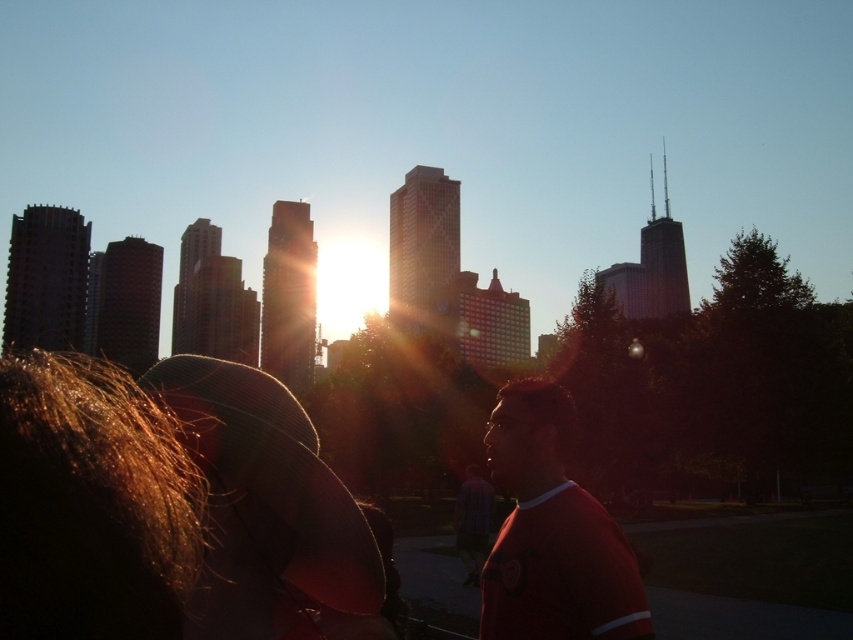
You are a photographer trying to capture the sunset scene. You notice two elements in the foreground, the shiny brown hair at lower left and the red matte shirt at center. Which of these elements appears narrower in your photo?

The shiny brown hair at lower left appears narrower in the photo because it has a lesser width compared to the red matte shirt at center.

You are a photographer trying to capture a shot of the shiny brown hair at lower left and the blue striped shirt at center. Based on their sizes in the image, which one would appear larger in your photo?

The shiny brown hair at lower left appears larger in the photo because it is much taller than the blue striped shirt at center.

Looking at this image, you are a photographer trying to capture the sunset in this urban scene. You notice two people in the frame. The person with shiny brown hair at lower left and the person wearing a blue striped shirt at center. Which of these two people is positioned more to the left side of the frame?

The shiny brown hair at lower left is positioned to the left of the blue striped shirt at center, so the person with shiny brown hair at lower left is more to the left side of the frame.